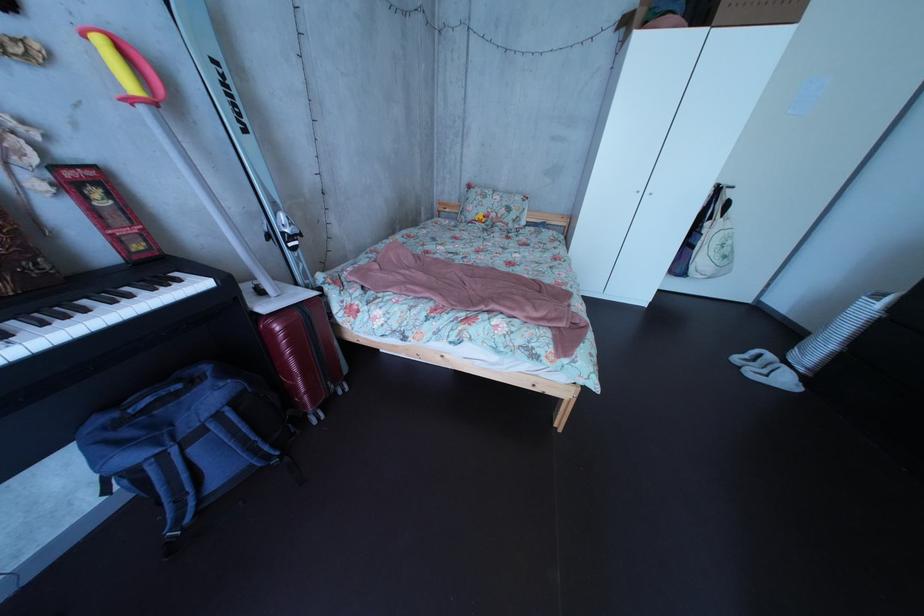
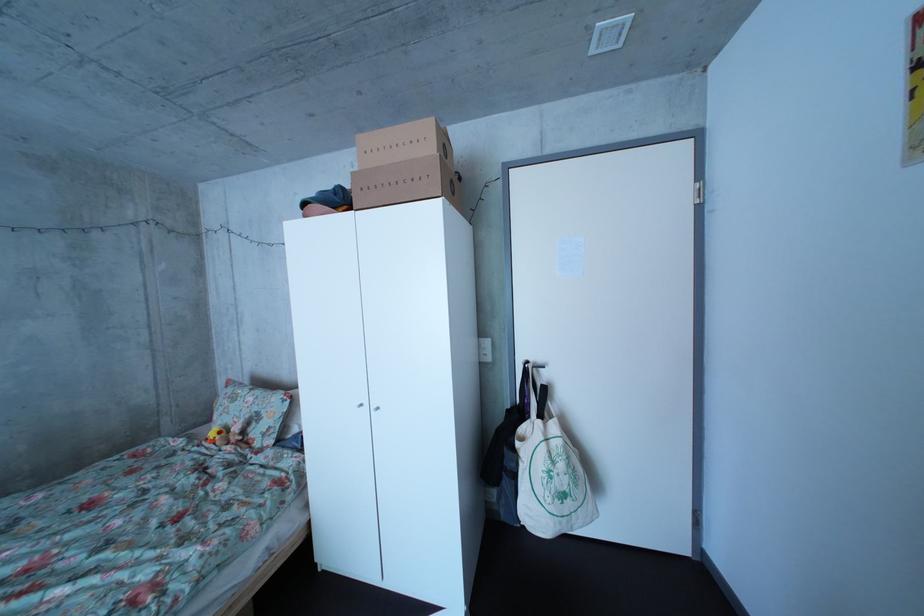
What movement of the cameraman would produce the second image?

The cameraman walked toward right, forward.